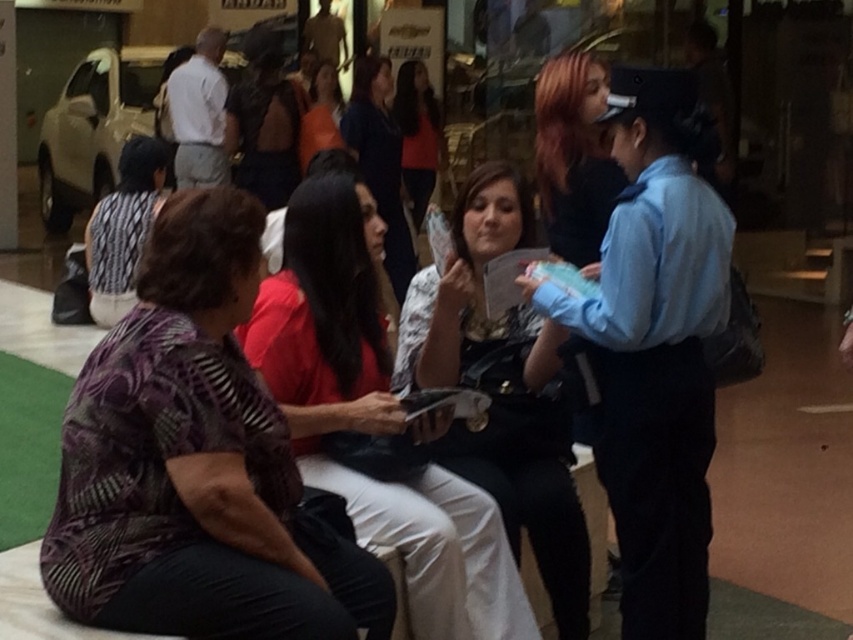
Question: Which point is closer to the camera?

Choices:
 (A) white fabric purse at center
 (B) printed fabric blouse at center
 (C) matte black shirt at center

Answer: (A)

Question: Does white fabric purse at center appear under matte black shirt at center?

Choices:
 (A) yes
 (B) no

Answer: (A)

Question: Is white fabric purse at center above printed fabric blouse at center?

Choices:
 (A) yes
 (B) no

Answer: (B)

Question: Among these points, which one is nearest to the camera?

Choices:
 (A) (328, 298)
 (B) (426, 140)
 (C) (225, 300)

Answer: (C)

Question: Which point appears farthest from the camera in this image?

Choices:
 (A) (430, 148)
 (B) (567, 442)
 (C) (273, 374)
 (D) (357, 556)

Answer: (A)

Question: Is white fabric purse at center smaller than matte black shirt at center?

Choices:
 (A) no
 (B) yes

Answer: (B)